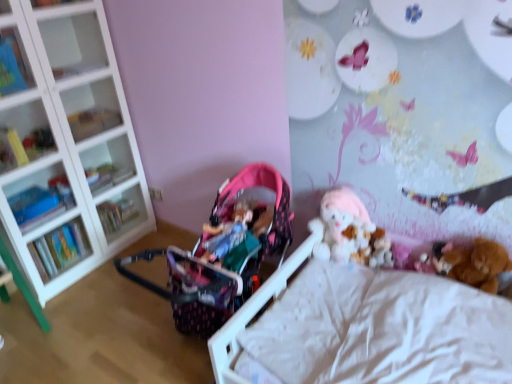
What do you see at coordinates (59, 249) in the screenshot?
I see `hardcover book at left` at bounding box center [59, 249].

What do you see at coordinates (475, 263) in the screenshot?
I see `brown plush bear at lower right, which is the third toy from left to right` at bounding box center [475, 263].

What do you see at coordinates (434, 259) in the screenshot?
I see `fuzzy brown teddy bear at lower right, marked as the 2th toy in a right-to-left arrangement` at bounding box center [434, 259].

Looking at this image, measure the distance between clear glass shelves at left, which ranks as the 2th shelf in bottom-to-top order, and camera.

clear glass shelves at left, which ranks as the 2th shelf in bottom-to-top order, and camera are 7.87 feet apart from each other.

Find the location of a particular element. This screenshot has width=512, height=384. clear glass shelves at left, which ranks as the 2th shelf in bottom-to-top order is located at coordinates (108, 164).

What do you see at coordinates (68, 147) in the screenshot?
I see `white glass shelf at left, positioned as the 3th shelf in top-to-bottom order` at bounding box center [68, 147].

Where is `fluffy pink plush at center, the 1th toy when ordered from left to right`? fluffy pink plush at center, the 1th toy when ordered from left to right is located at coordinates (349, 232).

Is fuzzy brown teddy bear at lower right, the second toy from the left, in contact with pink fabric baby carriage at center?

No.

Does fuzzy brown teddy bear at lower right, marked as the 2th toy in a right-to-left arrangement, have a smaller size compared to pink fabric baby carriage at center?

Indeed, fuzzy brown teddy bear at lower right, marked as the 2th toy in a right-to-left arrangement, has a smaller size compared to pink fabric baby carriage at center.

Which is behind, point (443, 256) or point (227, 308)?

Positioned behind is point (443, 256).

From a real-world perspective, is clear glass shelves at left, the fourth shelf in the top-to-bottom sequence, on top of hardcover book at left?

Correct, in the physical world, clear glass shelves at left, the fourth shelf in the top-to-bottom sequence, is higher than hardcover book at left.

Is there a large distance between clear glass shelves at left, which ranks as the 2th shelf in bottom-to-top order, and hardcover book at left?

No, clear glass shelves at left, which ranks as the 2th shelf in bottom-to-top order, is not far away from hardcover book at left.

Considering the positions of points (111, 170) and (59, 244), is point (111, 170) farther from camera compared to point (59, 244)?

Yes.

Where is `the 3rd shelf to the right of the hardcover book at left, counting from the anchor's position`? Image resolution: width=512 pixels, height=384 pixels. the 3rd shelf to the right of the hardcover book at left, counting from the anchor's position is located at coordinates (108, 164).

In terms of size, does brown plush bear at lower right, which is the third toy from left to right, appear bigger or smaller than white glass shelf at left, the third shelf ordered from the bottom?

brown plush bear at lower right, which is the third toy from left to right, is smaller than white glass shelf at left, the third shelf ordered from the bottom.

Is brown plush bear at lower right, which is counted as the first toy, starting from the right, turned away from white glass shelf at left, the third shelf ordered from the bottom?

No.

Which is correct: brown plush bear at lower right, which is counted as the first toy, starting from the right, is inside white glass shelf at left, the third shelf ordered from the bottom, or outside of it?

brown plush bear at lower right, which is counted as the first toy, starting from the right, exists outside the volume of white glass shelf at left, the third shelf ordered from the bottom.

From the image's perspective, between brown plush bear at lower right, which is the third toy from left to right, and white glass shelf at left, positioned as the 3th shelf in top-to-bottom order, which one is located above?

From the image's view, white glass shelf at left, positioned as the 3th shelf in top-to-bottom order, is above.

From the picture: From a real-world perspective, relative to fluffy pink plush at center, the 1th toy when ordered from left to right, is fuzzy brown teddy bear at lower right, the second toy from the left, vertically above or below?

From a real-world perspective, fuzzy brown teddy bear at lower right, the second toy from the left, is physically below fluffy pink plush at center, the 1th toy when ordered from left to right.

Looking at their sizes, would you say fuzzy brown teddy bear at lower right, the second toy from the left, is wider or thinner than fluffy pink plush at center, the 1th toy when ordered from left to right?

fuzzy brown teddy bear at lower right, the second toy from the left, is thinner than fluffy pink plush at center, the 1th toy when ordered from left to right.

Considering the sizes of objects fuzzy brown teddy bear at lower right, marked as the 2th toy in a right-to-left arrangement, and fluffy pink plush at center, which appears as the third toy when viewed from the right, in the image provided, who is bigger, fuzzy brown teddy bear at lower right, marked as the 2th toy in a right-to-left arrangement, or fluffy pink plush at center, which appears as the third toy when viewed from the right,?

fluffy pink plush at center, which appears as the third toy when viewed from the right.

Is fuzzy brown teddy bear at lower right, marked as the 2th toy in a right-to-left arrangement, positioned far away from fluffy pink plush at center, which appears as the third toy when viewed from the right?

No, there isn't a large distance between fuzzy brown teddy bear at lower right, marked as the 2th toy in a right-to-left arrangement, and fluffy pink plush at center, which appears as the third toy when viewed from the right.

Where is `baby carriage below the matte plastic books at left, the first shelf when ordered from bottom to top (from the image's perspective)`? Image resolution: width=512 pixels, height=384 pixels. baby carriage below the matte plastic books at left, the first shelf when ordered from bottom to top (from the image's perspective) is located at coordinates (211, 270).

Is matte plastic books at left, the first shelf when ordered from bottom to top, smaller than pink fabric baby carriage at center?

Indeed, matte plastic books at left, the first shelf when ordered from bottom to top, has a smaller size compared to pink fabric baby carriage at center.

Can you confirm if matte plastic books at left, the first shelf when ordered from bottom to top, is taller than pink fabric baby carriage at center?

No, matte plastic books at left, the first shelf when ordered from bottom to top, is not taller than pink fabric baby carriage at center.

From a real-world perspective, is matte plastic books at left, the first shelf when ordered from bottom to top, physically above pink fabric baby carriage at center?

Correct, in the physical world, matte plastic books at left, the first shelf when ordered from bottom to top, is higher than pink fabric baby carriage at center.

Measure the distance between pink fabric baby carriage at center and white glass shelf at left, positioned as the 3th shelf in top-to-bottom order.

They are 38.62 inches apart.

Considering the relative sizes of pink fabric baby carriage at center and white glass shelf at left, positioned as the 3th shelf in top-to-bottom order, in the image provided, is pink fabric baby carriage at center bigger than white glass shelf at left, positioned as the 3th shelf in top-to-bottom order,?

No, pink fabric baby carriage at center is not bigger than white glass shelf at left, positioned as the 3th shelf in top-to-bottom order.

From a real-world perspective, between pink fabric baby carriage at center and white glass shelf at left, positioned as the 3th shelf in top-to-bottom order, who is vertically lower?

In real-world perspective, pink fabric baby carriage at center is lower.

Would you say pink fabric baby carriage at center is a long distance from white glass shelf at left, positioned as the 3th shelf in top-to-bottom order?

They are positioned close to each other.

Are pink fabric baby carriage at center and fluffy pink plush at center, the 1th toy when ordered from left to right, far apart?

No.

Considering the sizes of objects pink fabric baby carriage at center and fluffy pink plush at center, the 1th toy when ordered from left to right, in the image provided, who is bigger, pink fabric baby carriage at center or fluffy pink plush at center, the 1th toy when ordered from left to right,?

pink fabric baby carriage at center.

Could you tell me if pink fabric baby carriage at center is facing fluffy pink plush at center, which appears as the third toy when viewed from the right?

No, pink fabric baby carriage at center is not turned towards fluffy pink plush at center, which appears as the third toy when viewed from the right.

I want to click on baby carriage below the fuzzy brown teddy bear at lower right, marked as the 2th toy in a right-to-left arrangement (from a real-world perspective), so click(211, 270).

In order to click on the 3rd shelf counting from the right side of the hardcover book at left in this screenshot , I will do `click(108, 164)`.

From the image, which object appears to be nearer to fluffy pink plush at center, which appears as the third toy when viewed from the right, fuzzy brown teddy bear at lower right, marked as the 2th toy in a right-to-left arrangement, or matte plastic books at left, the first shelf when ordered from bottom to top?

The object closer to fluffy pink plush at center, which appears as the third toy when viewed from the right, is fuzzy brown teddy bear at lower right, marked as the 2th toy in a right-to-left arrangement.

Which object lies further to the anchor point matte plastic books at left, positioned as the 5th shelf in top-to-bottom order, pink fabric baby carriage at center or fuzzy brown teddy bear at lower right, marked as the 2th toy in a right-to-left arrangement?

Among the two, fuzzy brown teddy bear at lower right, marked as the 2th toy in a right-to-left arrangement, is located further to matte plastic books at left, positioned as the 5th shelf in top-to-bottom order.

Considering their positions, is matte plastic books at left, the first shelf when ordered from bottom to top, positioned further to hardcover book at left than clear glass shelves at left, the fourth shelf in the top-to-bottom sequence?

The object further to hardcover book at left is clear glass shelves at left, the fourth shelf in the top-to-bottom sequence.

Which object lies nearer to the anchor point matte plastic shelf at upper left, the first shelf viewed from the top, brown plush bear at lower right, which is the third toy from left to right, or fluffy pink plush at center, the 1th toy when ordered from left to right?

fluffy pink plush at center, the 1th toy when ordered from left to right, is closer to matte plastic shelf at upper left, the first shelf viewed from the top.

When comparing their distances from matte plastic books at left, the first shelf when ordered from bottom to top, does brown plush bear at lower right, which is counted as the first toy, starting from the right, or hardcover book at left seem closer?

hardcover book at left is closer to matte plastic books at left, the first shelf when ordered from bottom to top.

When comparing their distances from matte plastic books at left, positioned as the 5th shelf in top-to-bottom order, does clear glass shelves at left, the fourth shelf in the top-to-bottom sequence, or fuzzy brown teddy bear at lower right, the second toy from the left, seem closer?

clear glass shelves at left, the fourth shelf in the top-to-bottom sequence.

From the image, which object appears to be farther from white glass shelf at left, the third shelf ordered from the bottom, pink fabric baby carriage at center or matte plastic shelf at upper left, the first shelf viewed from the top?

Based on the image, pink fabric baby carriage at center appears to be further to white glass shelf at left, the third shelf ordered from the bottom.

Estimate the real-world distances between objects in this image. Which object is further from hardcover book at left, clear glass shelf at upper left, placed as the 4th shelf when sorted from bottom to top, or brown plush bear at lower right, which is the third toy from left to right?

Based on the image, brown plush bear at lower right, which is the third toy from left to right, appears to be further to hardcover book at left.

The height and width of the screenshot is (384, 512). I want to click on baby carriage situated between matte plastic books at left, positioned as the 5th shelf in top-to-bottom order, and fuzzy brown teddy bear at lower right, marked as the 2th toy in a right-to-left arrangement, from left to right, so click(x=211, y=270).

The height and width of the screenshot is (384, 512). I want to click on toy between clear glass shelves at left, which ranks as the 2th shelf in bottom-to-top order, and fuzzy brown teddy bear at lower right, the second toy from the left, from left to right, so click(349, 232).

This screenshot has width=512, height=384. I want to click on book located between matte plastic shelf at upper left, the first shelf viewed from the top, and fluffy pink plush at center, which appears as the third toy when viewed from the right, in the left-right direction, so click(x=59, y=249).

I want to click on baby carriage between hardcover book at left and fluffy pink plush at center, the 1th toy when ordered from left to right, so 211,270.